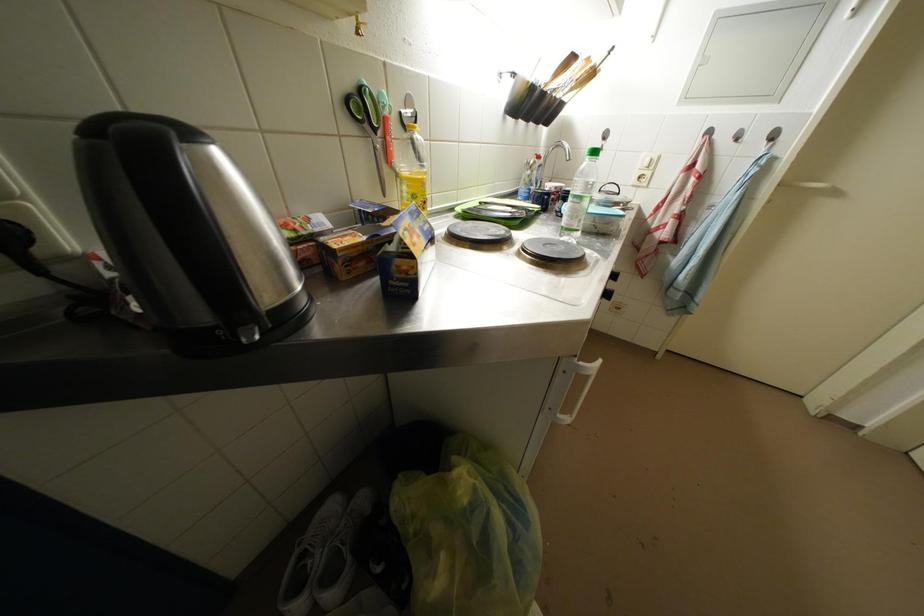
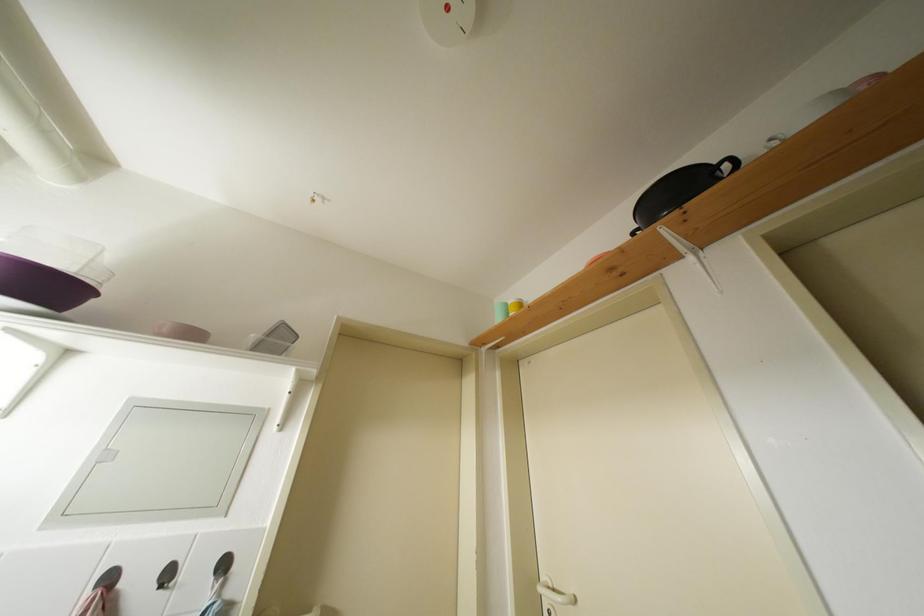
Based on the continuous images, in which direction is the camera rotating?

The camera rotated toward right-up.